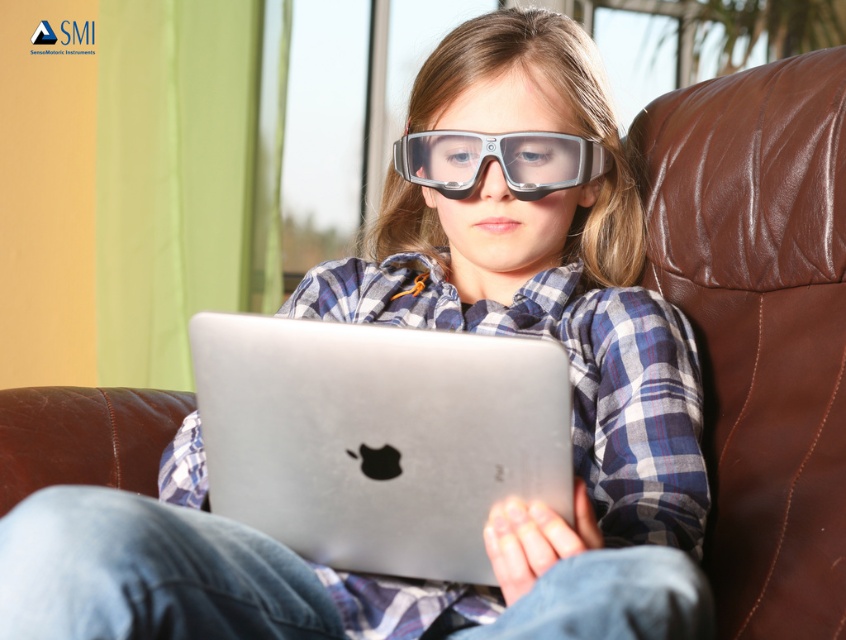
Question: Which object appears farthest from the camera in this image?

Choices:
 (A) transparent plastic goggles at center
 (B) silver metallic laptop at center

Answer: (A)

Question: Is silver metallic laptop at center to the left of transparent plastic goggles at center from the viewer's perspective?

Choices:
 (A) yes
 (B) no

Answer: (A)

Question: Does silver metallic laptop at center appear on the left side of transparent plastic goggles at center?

Choices:
 (A) no
 (B) yes

Answer: (B)

Question: Among these points, which one is farthest from the camera?

Choices:
 (A) (525, 170)
 (B) (449, 564)

Answer: (A)

Question: Is the position of silver metallic laptop at center more distant than that of transparent plastic goggles at center?

Choices:
 (A) yes
 (B) no

Answer: (B)

Question: Which object is farther from the camera taking this photo?

Choices:
 (A) silver metallic laptop at center
 (B) transparent plastic goggles at center

Answer: (B)